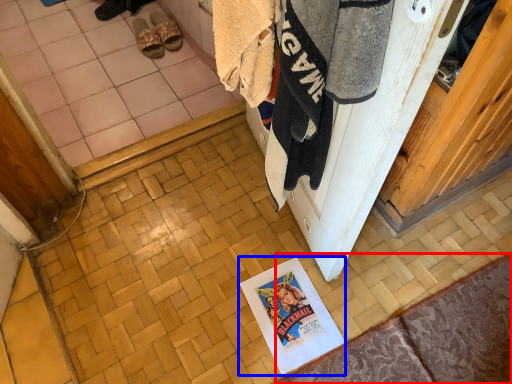
Question: Which point is further to the camera, doormat (highlighted by a red box) or poster page (highlighted by a blue box)?

Choices:
 (A) doormat
 (B) poster page

Answer: (B)